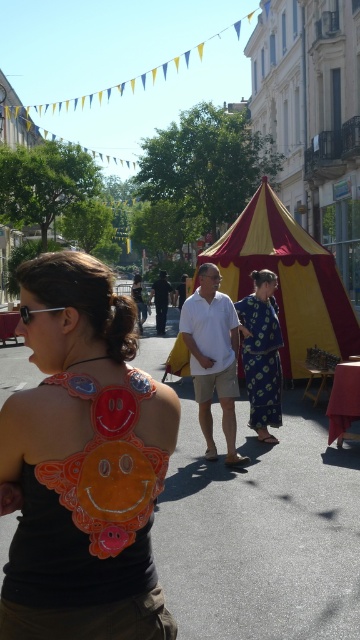
Question: Based on their relative distances, which object is farther from the white cotton shirt at center?

Choices:
 (A) yellow/red striped tent at center
 (B) blue printed dress at center
 (C) orange fabric smiley face at upper left

Answer: (C)

Question: Is yellow/red striped tent at center bigger than white cotton shirt at center?

Choices:
 (A) no
 (B) yes

Answer: (A)

Question: Which point is closer to the camera?

Choices:
 (A) white cotton shirt at center
 (B) orange fabric smiley face at upper left

Answer: (B)

Question: Which point appears farthest from the camera in this image?

Choices:
 (A) (28, 577)
 (B) (272, 416)

Answer: (B)

Question: Is orange fabric smiley face at upper left to the right of white cotton shirt at center from the viewer's perspective?

Choices:
 (A) no
 (B) yes

Answer: (A)

Question: Observing the image, what is the correct spatial positioning of orange fabric smiley face at upper left in reference to yellow/red striped tent at center?

Choices:
 (A) right
 (B) left

Answer: (B)